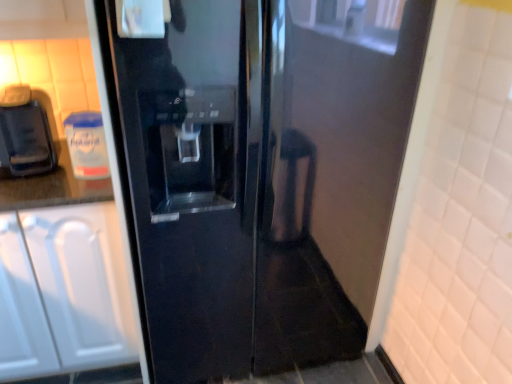
Question: Is matte black coffee machine at left not within white matte cabinet at left?

Choices:
 (A) no
 (B) yes

Answer: (B)

Question: Is matte black coffee machine at left taller than white matte cabinet at left?

Choices:
 (A) yes
 (B) no

Answer: (B)

Question: Is matte black coffee machine at left wider than white matte cabinet at left?

Choices:
 (A) no
 (B) yes

Answer: (A)

Question: Is matte black coffee machine at left looking in the opposite direction of white matte cabinet at left?

Choices:
 (A) yes
 (B) no

Answer: (B)

Question: From the image's perspective, is matte black coffee machine at left located beneath white matte cabinet at left?

Choices:
 (A) yes
 (B) no

Answer: (B)

Question: Considering their positions, is white matte cabinet at left located in front of or behind glossy black refrigerator at center?

Choices:
 (A) behind
 (B) front

Answer: (A)

Question: Is white matte cabinet at left situated inside glossy black refrigerator at center or outside?

Choices:
 (A) inside
 (B) outside

Answer: (B)

Question: Is point (37, 211) closer or farther from the camera than point (190, 203)?

Choices:
 (A) closer
 (B) farther

Answer: (A)

Question: From the image's perspective, is white matte cabinet at left above or below glossy black refrigerator at center?

Choices:
 (A) below
 (B) above

Answer: (A)

Question: From the image's perspective, relative to white matte cabinet at left, is matte black coffee machine at left above or below?

Choices:
 (A) below
 (B) above

Answer: (B)

Question: Looking at their shapes, would you say matte black coffee machine at left is wider or thinner than white matte cabinet at left?

Choices:
 (A) thin
 (B) wide

Answer: (A)

Question: Choose the correct answer: Is matte black coffee machine at left inside white matte cabinet at left or outside it?

Choices:
 (A) inside
 (B) outside

Answer: (B)

Question: From a real-world perspective, is matte black coffee machine at left physically located above or below white matte cabinet at left?

Choices:
 (A) above
 (B) below

Answer: (A)

Question: In terms of size, does matte black coffee machine at left appear bigger or smaller than glossy black refrigerator at center?

Choices:
 (A) small
 (B) big

Answer: (A)

Question: In terms of height, does matte black coffee machine at left look taller or shorter compared to glossy black refrigerator at center?

Choices:
 (A) tall
 (B) short

Answer: (B)